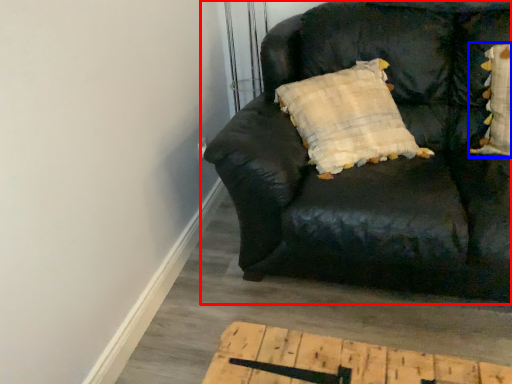
Question: Among these objects, which one is farthest to the camera, studio couch (highlighted by a red box) or pillow (highlighted by a blue box)?

Choices:
 (A) studio couch
 (B) pillow

Answer: (B)